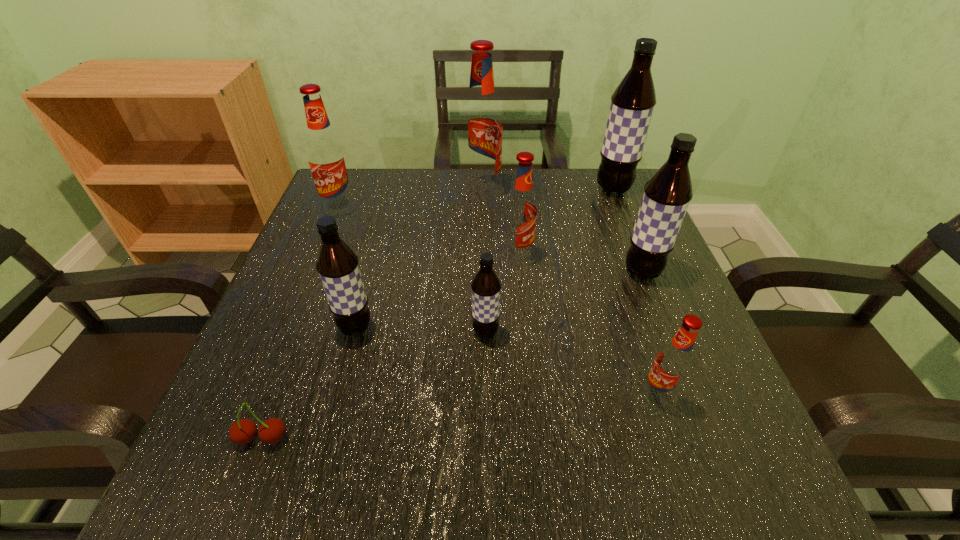
Image resolution: width=960 pixels, height=540 pixels. Find the location of `the rightmost red root beer`. the rightmost red root beer is located at coordinates (673, 362).

This screenshot has width=960, height=540. Identify the location of the nearest object. (271, 431).

Where is `cherry`? This screenshot has height=540, width=960. cherry is located at coordinates (271, 431).

Locate an element on the screen. blank area located on the front of the farthest brown root beer is located at coordinates (657, 295).

The width and height of the screenshot is (960, 540). I want to click on free space located 0.170m on the left of the biggest red root beer, so click(397, 191).

The image size is (960, 540). I want to click on vacant area situated 0.140m on the right of the leftmost red root beer, so click(x=414, y=210).

Identify the location of free space located on the left of the second biggest brown root beer. (512, 273).

Where is `free space located 0.110m on the right of the second nearest red root beer`? The image size is (960, 540). free space located 0.110m on the right of the second nearest red root beer is located at coordinates (584, 255).

Image resolution: width=960 pixels, height=540 pixels. Identify the location of vacant region located on the front of the leftmost brown root beer. coord(324,444).

Identify the location of vacant region located 0.110m on the right of the smallest brown root beer. (560, 332).